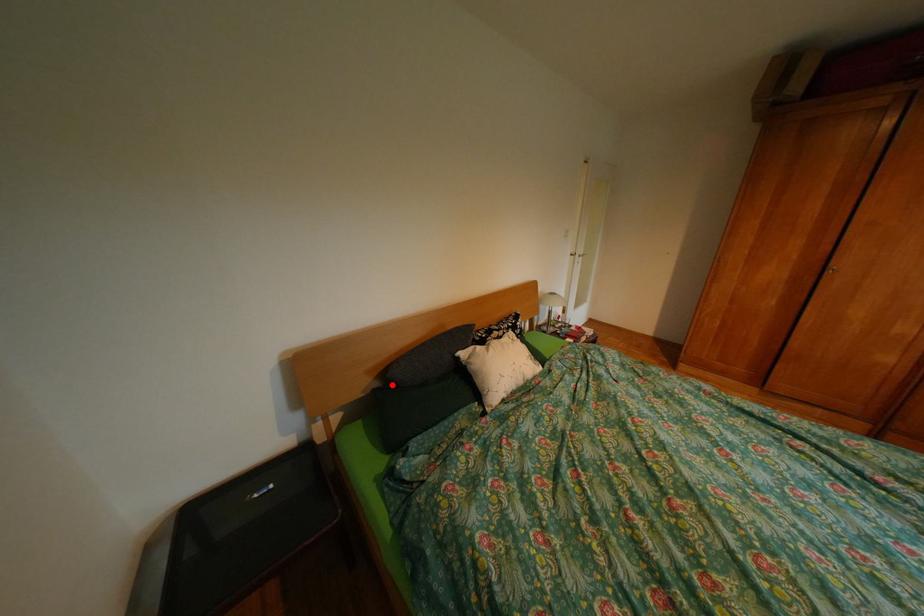
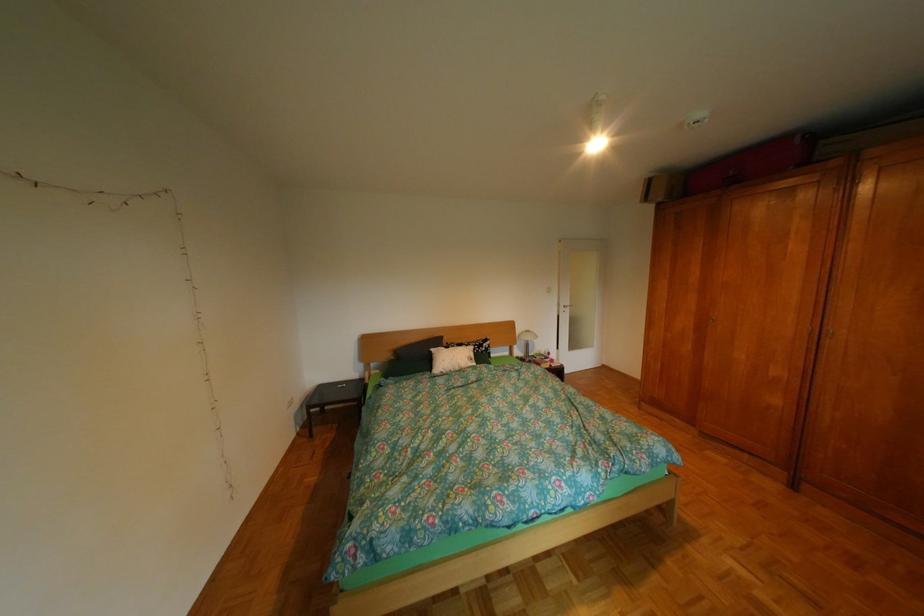
Question: I am providing you with two images of the same scene from different viewpoints. Image1 has a red point marked. In image2, the corresponding 3D location appears at what relative position? Reply with the corresponding letter.

Choices:
 (A) Closer
 (B) Farther

Answer: (A)